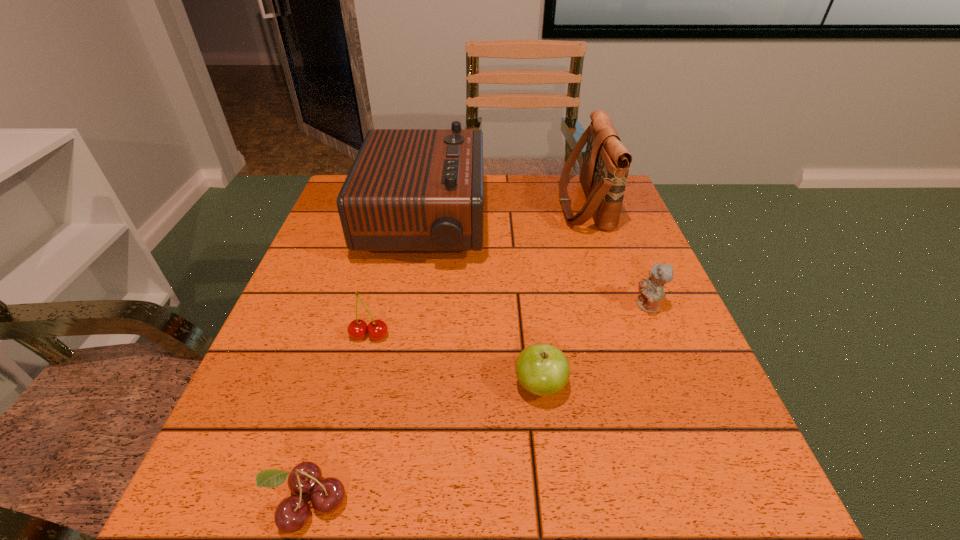
Where is `unoccupied position between the nearest object and the teddy bear`? This screenshot has height=540, width=960. unoccupied position between the nearest object and the teddy bear is located at coordinates (478, 404).

Where is `free space between the radio receiver and the third farthest object`? free space between the radio receiver and the third farthest object is located at coordinates (536, 265).

This screenshot has width=960, height=540. I want to click on blank region between the nearest object and the shoulder bag, so pos(445,354).

You are a GUI agent. You are given a task and a screenshot of the screen. Output one action in this format:
    pyautogui.click(x=<x>, y=<y>)
    Task: Click on the vacant area that lies between the nearer cherry and the third farthest object
    The width and height of the screenshot is (960, 540).
    Given the screenshot: What is the action you would take?
    pyautogui.click(x=478, y=404)

This screenshot has height=540, width=960. Identify the location of vacant area that lies between the third farthest object and the apple. (594, 346).

You are a GUI agent. You are given a task and a screenshot of the screen. Output one action in this format:
    pyautogui.click(x=<x>, y=<y>)
    Task: Click on the free spot between the apple and the farther cherry
    
    Given the screenshot: What is the action you would take?
    pyautogui.click(x=455, y=361)

I want to click on vacant space that is in between the radio receiver and the third object from right to left, so click(x=482, y=305).

At what (x,y) coordinates should I click in order to perform the action: click on free point between the teddy bear and the fifth farthest object. Please return your answer as a coordinate pair (x, y). Looking at the image, I should click on (594, 346).

Identify the location of vacant space that's between the radio receiver and the nearer cherry. (366, 363).

Locate which object is the fourth closest to the apple. Please provide its 2D coordinates. Your answer should be formatted as a tuple, i.e. [(x, y)], where the tuple contains the x and y coordinates of a point satisfying the conditions above.

[(327, 495)]